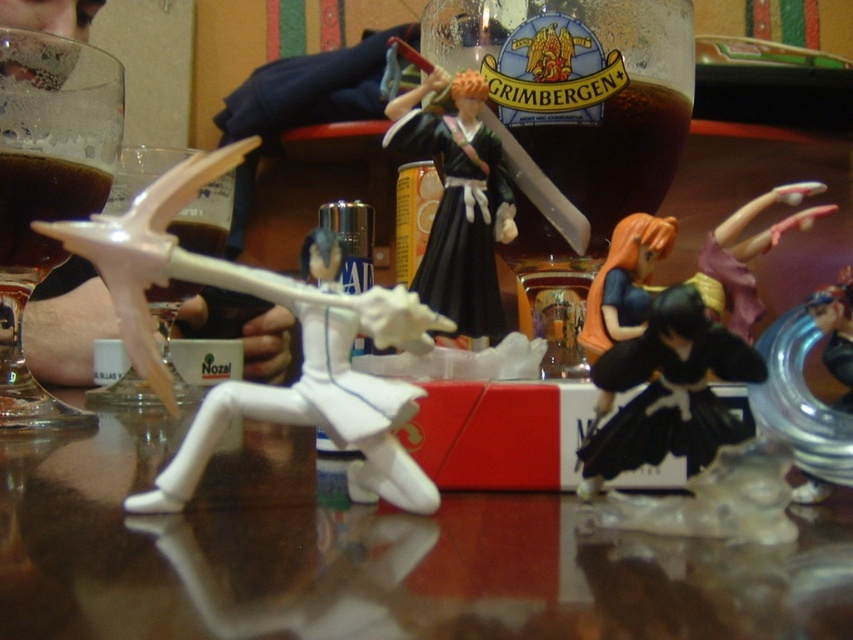
You are arranging items on a table and need to know the spatial relationship between the transparent glass at left and the black matte dress at center. Which object is positioned higher in the scene?

The transparent glass at left is located above the black matte dress at center, so it is positioned higher in the scene.

You are arranging a display and need to place a small statue that is 10 cm tall. Which object between the transparent glass at left and the black matte dress at center would allow the statue to fit underneath without touching the top?

The transparent glass at left is taller than the black matte dress at center, so the statue can be placed under the black matte dress at center since it is shorter and leaves enough space.

You are a collector who wants to display both the black matte figure at center and the brown liquid at left on a shelf. Which object should you place on the lower shelf to ensure stability?

The black matte figure at center is much taller than the brown liquid at left, so it should be placed on the lower shelf to ensure stability.